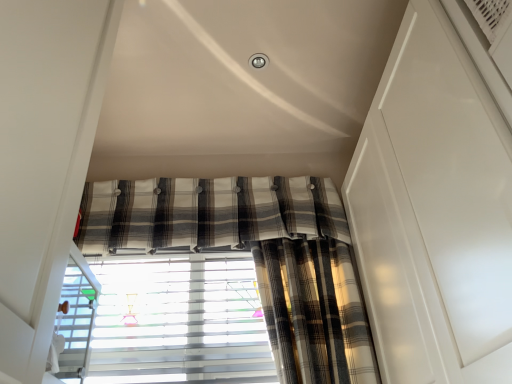
Question: Is plaid fabric curtain at center at the left side of white textured blinds at center?

Choices:
 (A) yes
 (B) no

Answer: (B)

Question: From a real-world perspective, is plaid fabric curtain at center physically below white textured blinds at center?

Choices:
 (A) no
 (B) yes

Answer: (A)

Question: Can you confirm if plaid fabric curtain at center is thinner than white textured blinds at center?

Choices:
 (A) no
 (B) yes

Answer: (A)

Question: Does plaid fabric curtain at center come behind white textured blinds at center?

Choices:
 (A) no
 (B) yes

Answer: (B)

Question: Is plaid fabric curtain at center outside of white textured blinds at center?

Choices:
 (A) yes
 (B) no

Answer: (A)

Question: Is plaid fabric curtain at center positioned with its back to white textured blinds at center?

Choices:
 (A) no
 (B) yes

Answer: (A)

Question: Considering the relative sizes of white textured blinds at center and plaid fabric curtain at center in the image provided, is white textured blinds at center wider than plaid fabric curtain at center?

Choices:
 (A) no
 (B) yes

Answer: (A)

Question: Is white textured blinds at center not within plaid fabric curtain at center?

Choices:
 (A) yes
 (B) no

Answer: (A)

Question: Considering the relative sizes of white textured blinds at center and plaid fabric curtain at center in the image provided, is white textured blinds at center thinner than plaid fabric curtain at center?

Choices:
 (A) no
 (B) yes

Answer: (B)

Question: Is white textured blinds at center smaller than plaid fabric curtain at center?

Choices:
 (A) no
 (B) yes

Answer: (B)

Question: From a real-world perspective, is white textured blinds at center over plaid fabric curtain at center?

Choices:
 (A) yes
 (B) no

Answer: (B)

Question: Could you tell me if white textured blinds at center is facing plaid fabric curtain at center?

Choices:
 (A) yes
 (B) no

Answer: (B)

Question: Considering their positions, is white textured blinds at center located in front of or behind plaid fabric curtain at center?

Choices:
 (A) front
 (B) behind

Answer: (A)